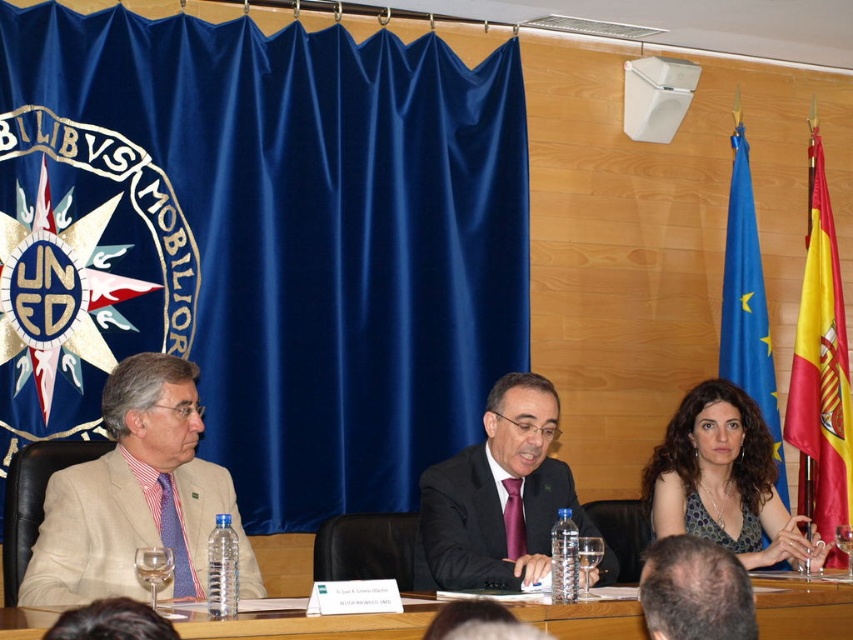
Which is more to the right, sparkly blue dress at center or yellow/red fabric flag at right?

From the viewer's perspective, yellow/red fabric flag at right appears more on the right side.

Between point (773, 529) and point (846, 385), which one is positioned in front?

Point (773, 529) is in front.

What do you see at coordinates (723, 481) in the screenshot? I see `sparkly blue dress at center` at bounding box center [723, 481].

This screenshot has height=640, width=853. Identify the location of sparkly blue dress at center. (723, 481).

Which of these two, wooden table at center or blue fabric curtain at upper right, stands shorter?

Standing shorter between the two is wooden table at center.

Does wooden table at center come in front of blue fabric curtain at upper right?

Yes, it is.

What do you see at coordinates (311, 625) in the screenshot?
I see `wooden table at center` at bounding box center [311, 625].

The height and width of the screenshot is (640, 853). I want to click on wooden table at center, so click(x=311, y=625).

Does point (531, 408) come closer to viewer compared to point (54, 614)?

That is False.

In order to click on dark suit at center in this screenshot , I will do `click(497, 496)`.